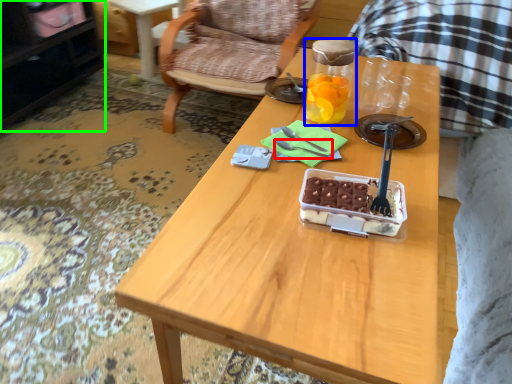
Question: Which object is the farthest from fork (highlighted by a red box)? Choose among these: bottle (highlighted by a blue box) or cabinetry (highlighted by a green box).

Choices:
 (A) bottle
 (B) cabinetry

Answer: (B)